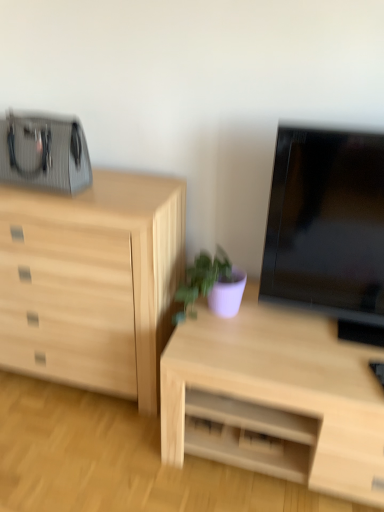
Where is `vacant space in purple matte plant at center (from a real-world perspective)`? This screenshot has width=384, height=512. vacant space in purple matte plant at center (from a real-world perspective) is located at coordinates (203, 315).